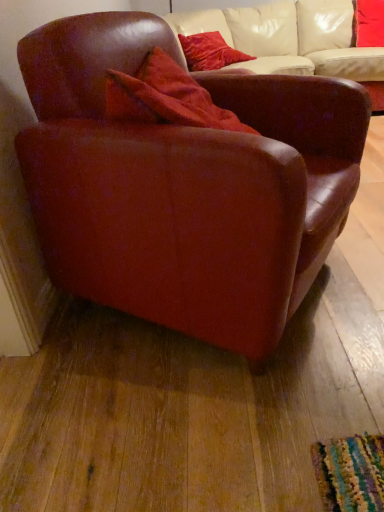
Question: Should I look upward or downward to see velvet red pillow at upper center, acting as the 1th pillow starting from the right?

Choices:
 (A) down
 (B) up

Answer: (B)

Question: Is velvet red pillow at upper center, which is the 2th pillow from right to left, not inside leather armchair at left?

Choices:
 (A) yes
 (B) no

Answer: (A)

Question: From the image's perspective, is velvet red pillow at upper center, which is the 2th pillow from right to left, below leather armchair at left?

Choices:
 (A) no
 (B) yes

Answer: (A)

Question: Considering the relative positions of velvet red pillow at upper center, the first pillow in the left-to-right sequence, and leather armchair at left in the image provided, is velvet red pillow at upper center, the first pillow in the left-to-right sequence, behind leather armchair at left?

Choices:
 (A) no
 (B) yes

Answer: (B)

Question: Can you confirm if velvet red pillow at upper center, the first pillow in the left-to-right sequence, is positioned to the left of leather armchair at left?

Choices:
 (A) no
 (B) yes

Answer: (A)

Question: Can you confirm if velvet red pillow at upper center, which is the 2th pillow from right to left, is bigger than leather armchair at left?

Choices:
 (A) yes
 (B) no

Answer: (B)

Question: Can you confirm if velvet red pillow at upper center, which is the 2th pillow from right to left, is wider than leather armchair at left?

Choices:
 (A) no
 (B) yes

Answer: (A)

Question: Considering the relative positions of velvet red pillow at upper center, the first pillow in the left-to-right sequence, and velvet red pillow at upper center, the second pillow positioned from the left, in the image provided, is velvet red pillow at upper center, the first pillow in the left-to-right sequence, in front of velvet red pillow at upper center, the second pillow positioned from the left,?

Choices:
 (A) yes
 (B) no

Answer: (A)

Question: Is velvet red pillow at upper center, the first pillow in the left-to-right sequence, bigger than velvet red pillow at upper center, acting as the 1th pillow starting from the right?

Choices:
 (A) no
 (B) yes

Answer: (A)

Question: Does velvet red pillow at upper center, the first pillow in the left-to-right sequence, appear on the right side of velvet red pillow at upper center, the second pillow positioned from the left?

Choices:
 (A) yes
 (B) no

Answer: (B)

Question: Would you consider velvet red pillow at upper center, which is the 2th pillow from right to left, to be distant from velvet red pillow at upper center, acting as the 1th pillow starting from the right?

Choices:
 (A) no
 (B) yes

Answer: (B)

Question: From a real-world perspective, is velvet red pillow at upper center, the first pillow in the left-to-right sequence, under velvet red pillow at upper center, the second pillow positioned from the left?

Choices:
 (A) yes
 (B) no

Answer: (A)

Question: From the image's perspective, does velvet red pillow at upper center, which is the 2th pillow from right to left, appear lower than velvet red pillow at upper center, the second pillow positioned from the left?

Choices:
 (A) yes
 (B) no

Answer: (A)

Question: Considering the relative sizes of leather armchair at left and velvet red pillow at upper center, acting as the 1th pillow starting from the right, in the image provided, is leather armchair at left thinner than velvet red pillow at upper center, acting as the 1th pillow starting from the right,?

Choices:
 (A) no
 (B) yes

Answer: (A)